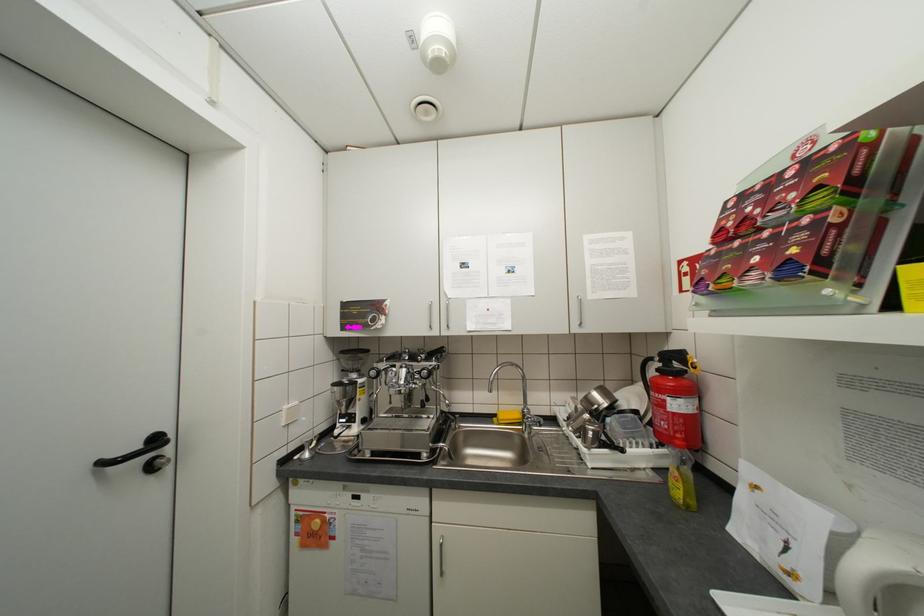
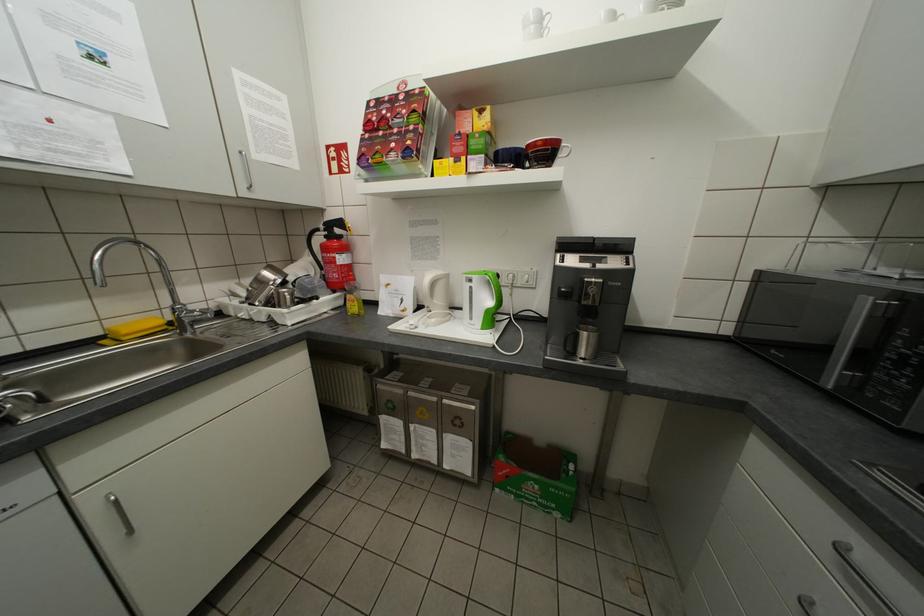
The point at [843,517] is marked in the first image. Where is the corresponding point in the second image?

(423, 277)